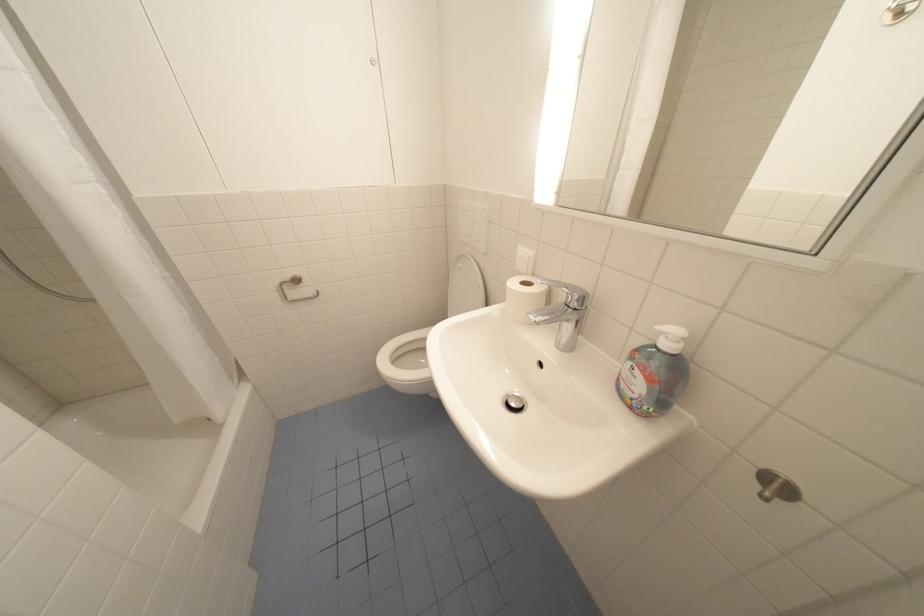
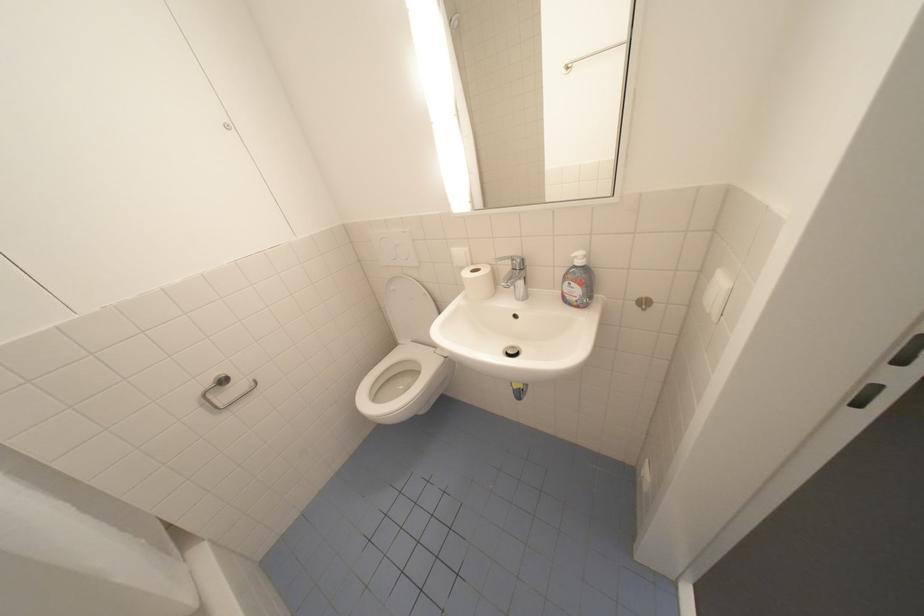
Question: The camera is either moving clockwise (left) or counter-clockwise (right) around the object. The first image is from the beginning of the video and the second image is from the end. Is the camera moving left or right when shooting the video?

Choices:
 (A) Left
 (B) Right

Answer: (A)